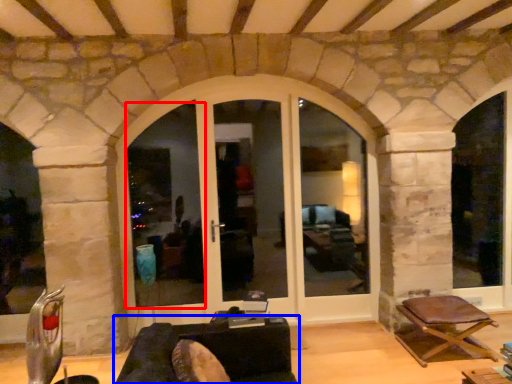
Question: Which point is closer to the camera, window frame (highlighted by a red box) or studio couch (highlighted by a blue box)?

Choices:
 (A) window frame
 (B) studio couch

Answer: (B)